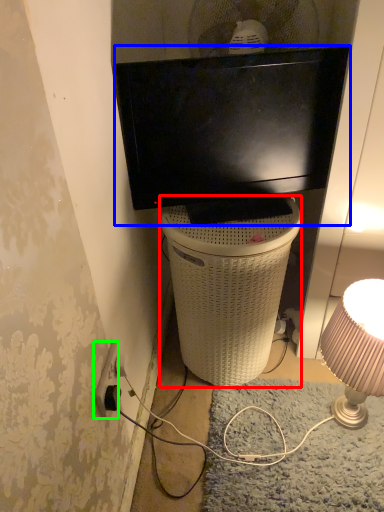
Question: Estimate the real-world distances between objects in this image. Which object is farther from trash bin/can (highlighted by a red box), television (highlighted by a blue box) or power outlet (highlighted by a green box)?

Choices:
 (A) television
 (B) power outlet

Answer: (B)